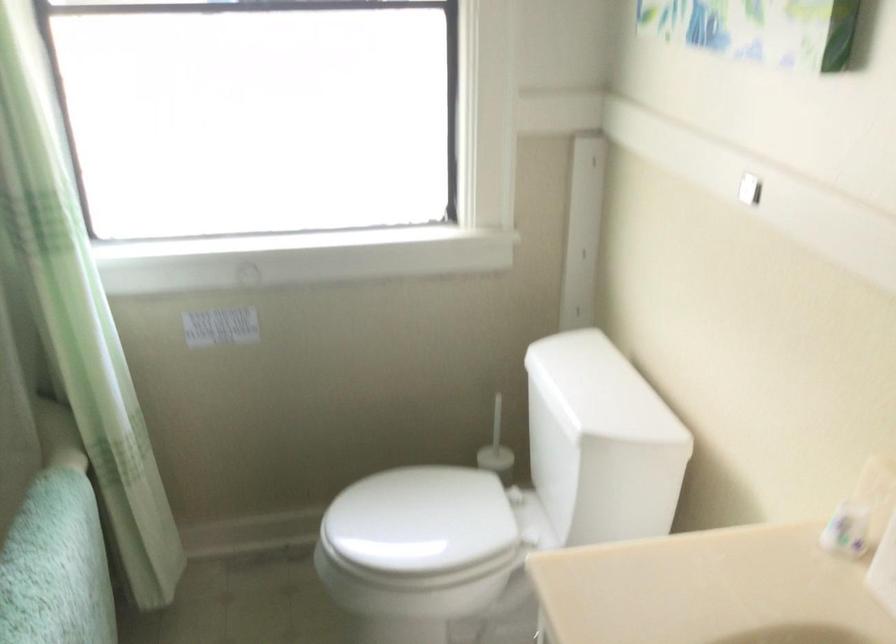
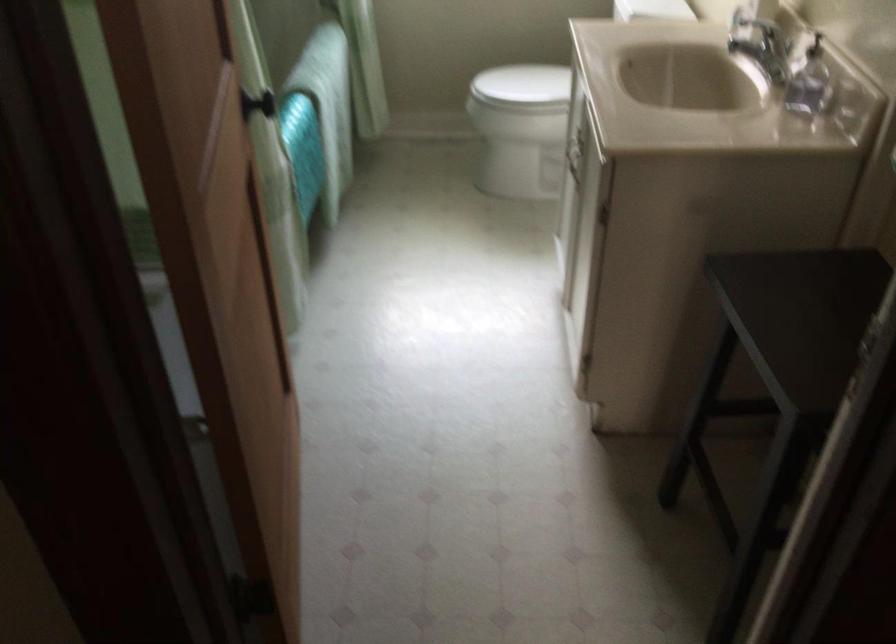
In the second image, find the point that corresponds to point 409,520 in the first image.

(522, 84)